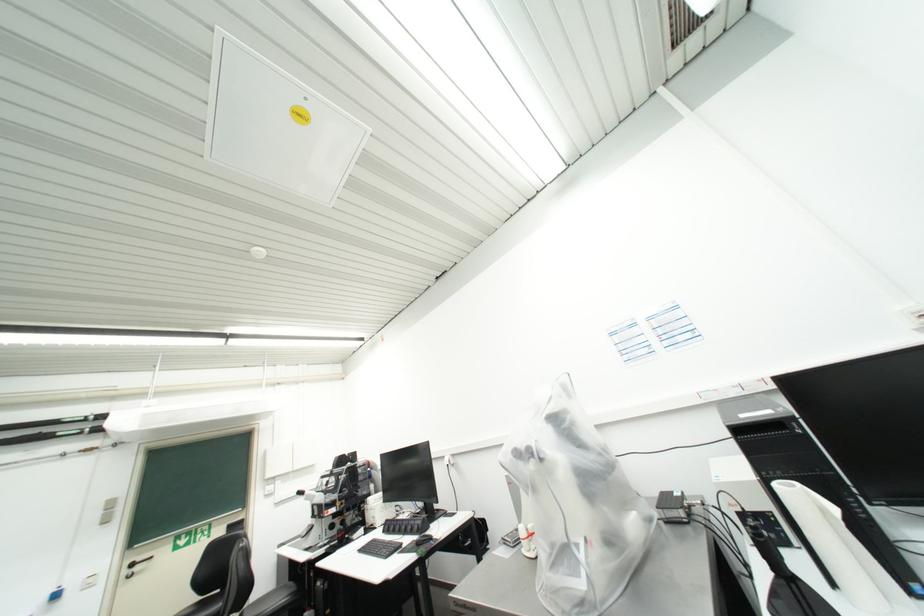
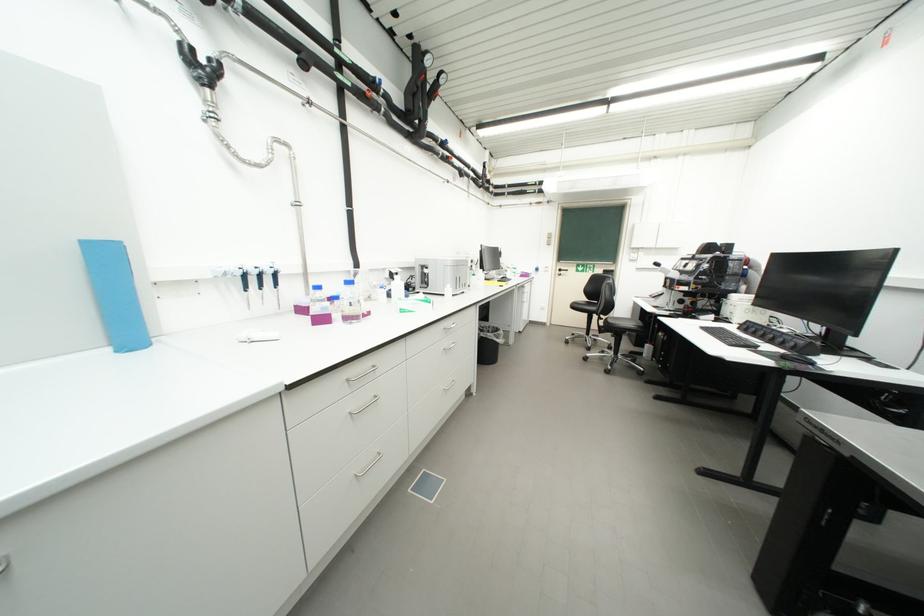
The images are taken continuously from a first-person perspective. In which direction is your viewpoint rotating?

The rotation direction of the camera is left-down.